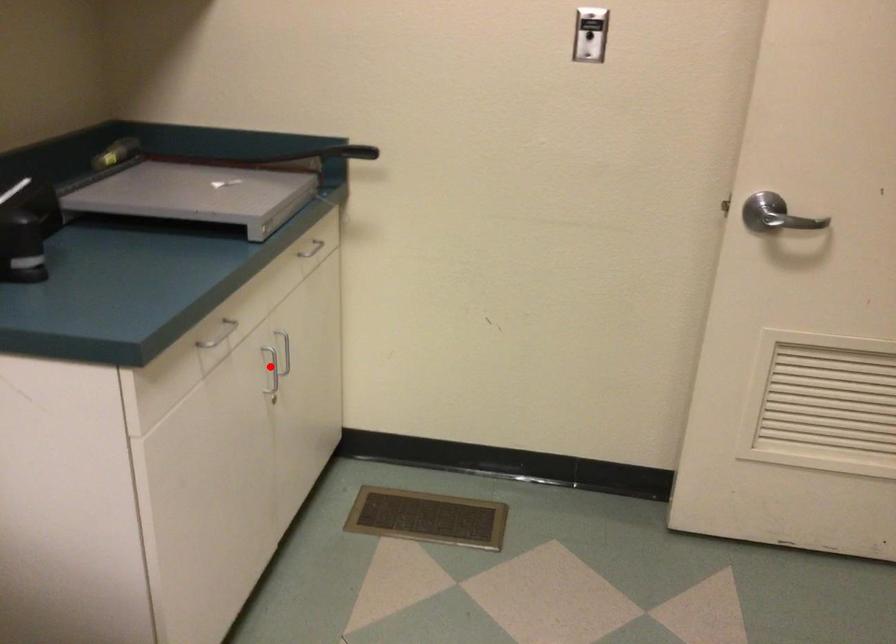
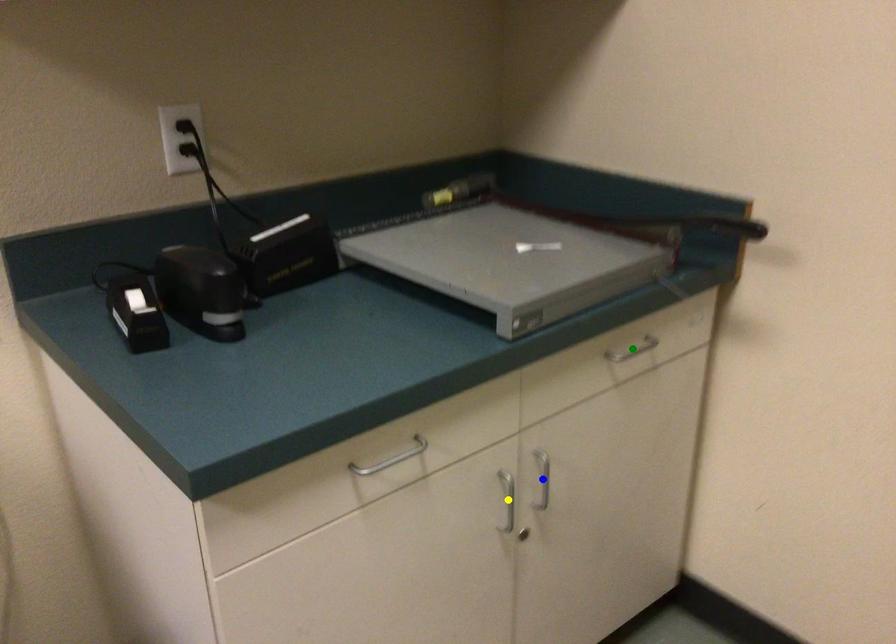
Question: I am providing you with two images of the same scene from different viewpoints. A red point is marked on the first image. You are given multiple points on the second image. In image 2, which mark is for the same physical point as the one in image 1?

Choices:
 (A) green point
 (B) blue point
 (C) yellow point

Answer: (C)